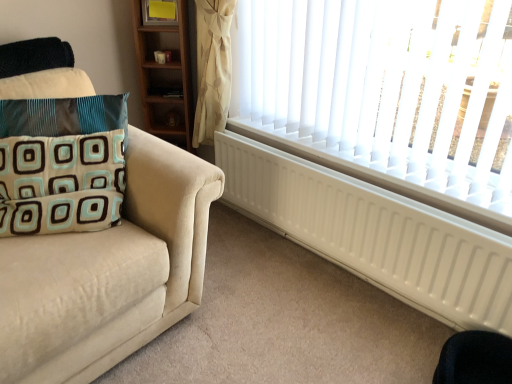
Where is `free space to the left of black fabric swivel chair at lower right`? free space to the left of black fabric swivel chair at lower right is located at coordinates (373, 361).